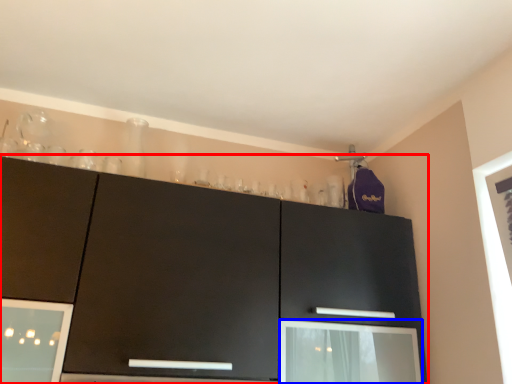
Question: Which object appears farthest to the camera in this image, cabinetry (highlighted by a red box) or screen door (highlighted by a blue box)?

Choices:
 (A) cabinetry
 (B) screen door

Answer: (B)